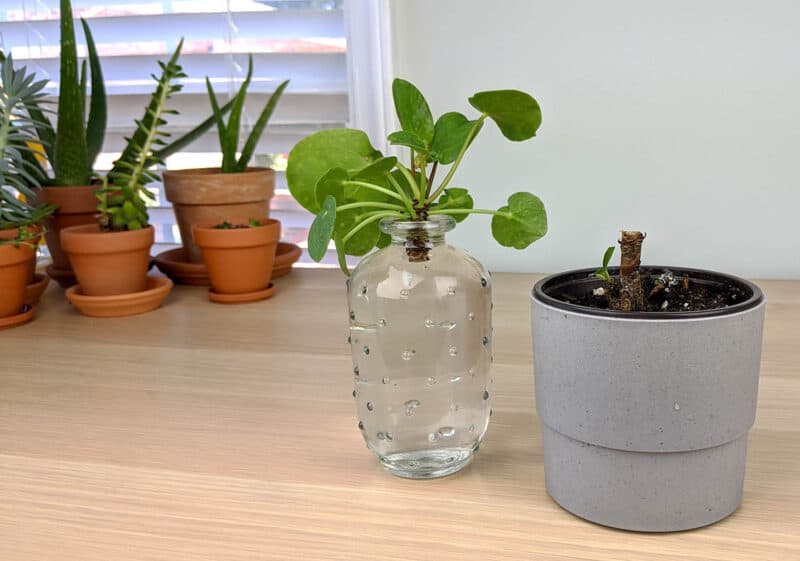
What are the coordinates of `orange potted plants` in the screenshot? It's located at (238, 257), (116, 261), (22, 277), (84, 200), (210, 199).